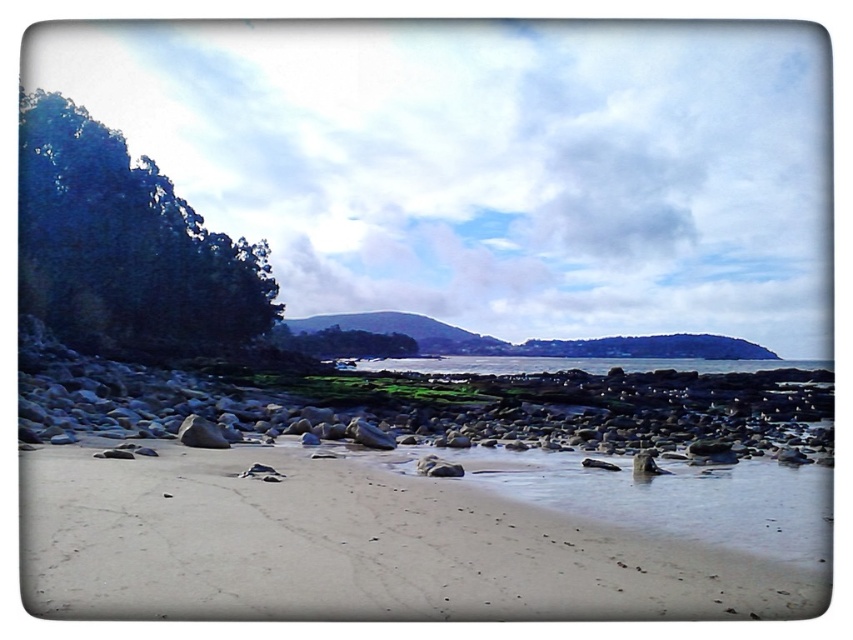
Question: Is clear blue water at center above smooth gray rock at lower left?

Choices:
 (A) yes
 (B) no

Answer: (B)

Question: Is clear blue water at center bigger than smooth gray rock at lower left?

Choices:
 (A) no
 (B) yes

Answer: (B)

Question: Which object is positioned farthest from the clear blue water at center?

Choices:
 (A) smooth gray rock at lower left
 (B) sandy beach at lower center

Answer: (A)

Question: Among these points, which one is farthest from the camera?

Choices:
 (A) (207, 433)
 (B) (405, 483)

Answer: (A)

Question: Is sandy beach at lower center behind clear blue water at center?

Choices:
 (A) no
 (B) yes

Answer: (A)

Question: Which point appears closest to the camera in this image?

Choices:
 (A) [395, 596]
 (B) [184, 419]
 (C) [643, 369]

Answer: (A)